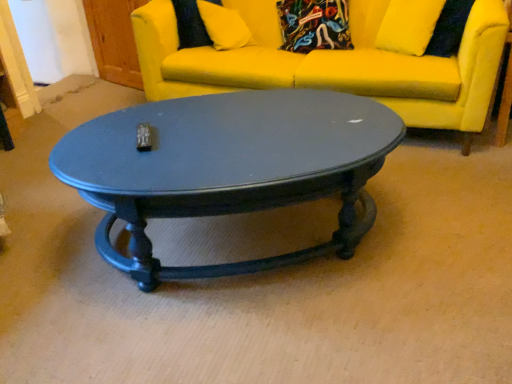
The width and height of the screenshot is (512, 384). Identify the location of vacant area that is in front of matte black coffee table at center. (263, 337).